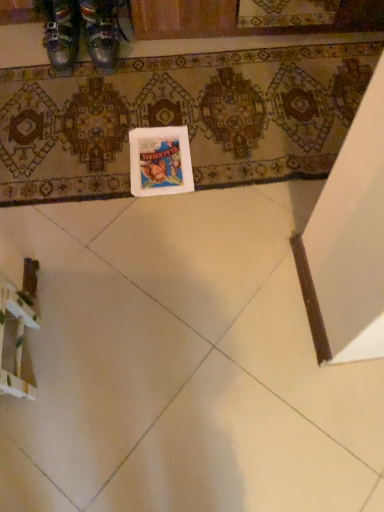
Question: From the image's perspective, does white glossy tile at lower left appear lower than metallic leather shoes at upper left, which is counted as the first footwear, starting from the left?

Choices:
 (A) yes
 (B) no

Answer: (A)

Question: Is white glossy tile at lower left in front of metallic leather shoes at upper left, which ranks as the second footwear in right-to-left order?

Choices:
 (A) yes
 (B) no

Answer: (A)

Question: From a real-world perspective, is white glossy tile at lower left positioned under metallic leather shoes at upper left, which ranks as the second footwear in right-to-left order, based on gravity?

Choices:
 (A) yes
 (B) no

Answer: (A)

Question: Is white glossy tile at lower left facing away from metallic leather shoes at upper left, which is counted as the first footwear, starting from the left?

Choices:
 (A) yes
 (B) no

Answer: (B)

Question: Is white glossy tile at lower left further to the viewer compared to metallic leather shoes at upper left, which ranks as the second footwear in right-to-left order?

Choices:
 (A) yes
 (B) no

Answer: (B)

Question: Visually, is metallic leather shoes at upper left, the 1th footwear from the right, positioned to the left or to the right of patterned carpet at center?

Choices:
 (A) left
 (B) right

Answer: (A)

Question: From a real-world perspective, is metallic leather shoes at upper left, arranged as the second footwear when viewed from the left, positioned above or below patterned carpet at center?

Choices:
 (A) below
 (B) above

Answer: (B)

Question: In terms of width, does metallic leather shoes at upper left, arranged as the second footwear when viewed from the left, look wider or thinner when compared to patterned carpet at center?

Choices:
 (A) thin
 (B) wide

Answer: (A)

Question: Is metallic leather shoes at upper left, the 1th footwear from the right, situated inside patterned carpet at center or outside?

Choices:
 (A) inside
 (B) outside

Answer: (B)

Question: Based on their positions, is patterned carpet at center located to the left or right of metallic leather shoes at upper left, which is counted as the first footwear, starting from the left?

Choices:
 (A) left
 (B) right

Answer: (B)

Question: Is patterned carpet at center in front of or behind metallic leather shoes at upper left, which ranks as the second footwear in right-to-left order, in the image?

Choices:
 (A) front
 (B) behind

Answer: (A)

Question: Looking at the image, does patterned carpet at center seem bigger or smaller compared to metallic leather shoes at upper left, which ranks as the second footwear in right-to-left order?

Choices:
 (A) small
 (B) big

Answer: (B)

Question: From a real-world perspective, relative to metallic leather shoes at upper left, which is counted as the first footwear, starting from the left, is patterned carpet at center vertically above or below?

Choices:
 (A) below
 (B) above

Answer: (A)

Question: From a real-world perspective, is metallic leather shoes at upper left, which ranks as the second footwear in right-to-left order, above or below white matte postcard at center?

Choices:
 (A) above
 (B) below

Answer: (A)

Question: Which is correct: metallic leather shoes at upper left, which ranks as the second footwear in right-to-left order, is inside white matte postcard at center, or outside of it?

Choices:
 (A) outside
 (B) inside

Answer: (A)